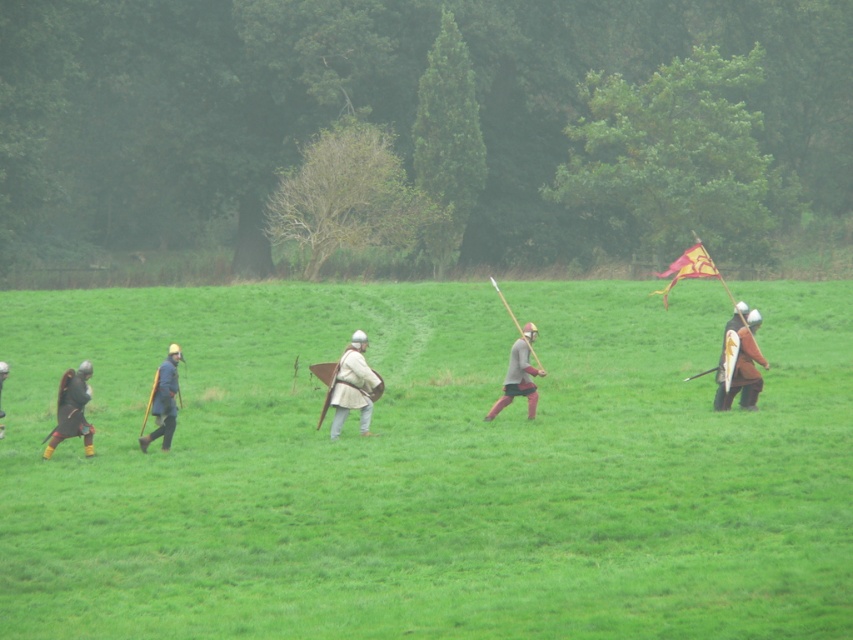
Question: Which is nearer to the matte black armor at left?

Choices:
 (A) light brown leather armor at center
 (B) brown leather shield at right

Answer: (A)

Question: Is dark brown leather armor at left positioned in front of matte black armor at left?

Choices:
 (A) yes
 (B) no

Answer: (A)

Question: Is brown leather shield at right bigger than brown leather armor at center?

Choices:
 (A) yes
 (B) no

Answer: (B)

Question: Which point is closer to the camera?

Choices:
 (A) light brown leather armor at center
 (B) blue fabric shield at left

Answer: (B)

Question: Is dark brown leather armor at left bigger than matte black armor at left?

Choices:
 (A) yes
 (B) no

Answer: (A)

Question: Estimate the real-world distances between objects in this image. Which object is farther from the brown leather armor at center?

Choices:
 (A) green grass field at center
 (B) blue fabric shield at left

Answer: (A)